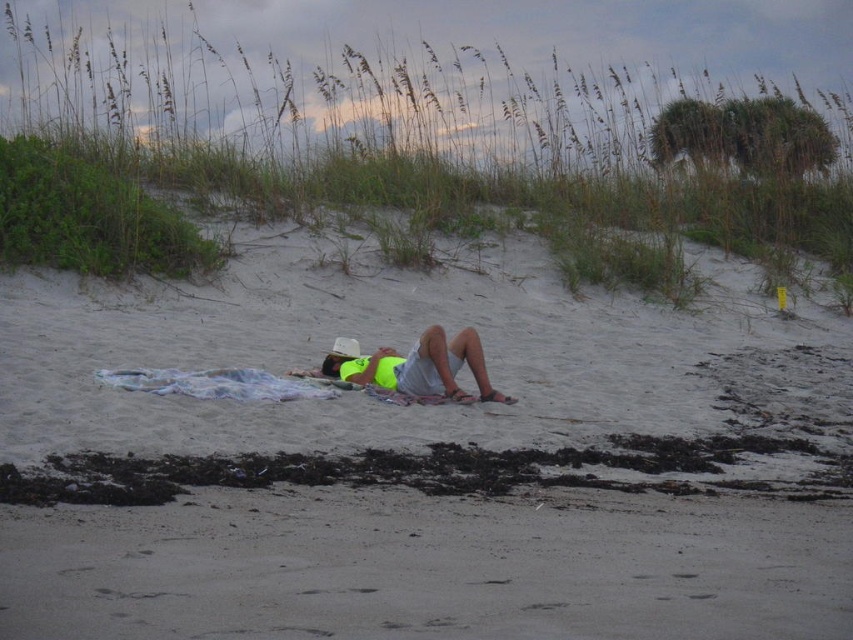
You are standing at the center of the beach and want to find the neon yellow shirt at center. According to the coordinates provided, in which direction should you look to locate it?

The neon yellow shirt at center is located at point [421,368], which means it is slightly to the right and slightly above the center point of the image. So, you should look towards the upper right direction from the center to find it.

You are standing at the edge of the beach looking towards the water. There are two points marked on the sand. The first point is at coordinate [445,576] and the second is at [381,358]. Which point is closer to you?

Point [445,576] is closer to the viewer than point [381,358].

Based on the photo, you are a photographer trying to capture a closeup shot of the neon yellow shirt at center. Given that the white sand at center is in the way, can you determine if the sand is too large to block the entire shirt?

The white sand at center is larger in size than the neon yellow shirt at center, so it would block the entire shirt if positioned directly in front of it.